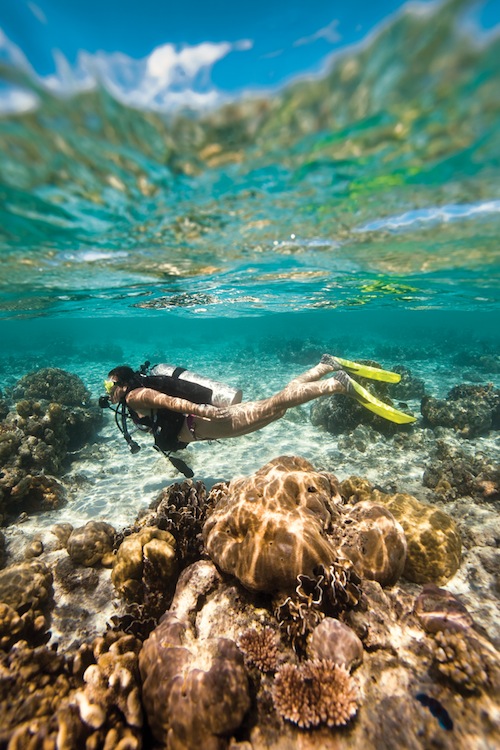
Image resolution: width=500 pixels, height=750 pixels. Identify the location of sponges. (x=322, y=702), (x=263, y=656), (x=463, y=657), (x=56, y=415), (x=27, y=410), (x=59, y=396), (x=26, y=457).